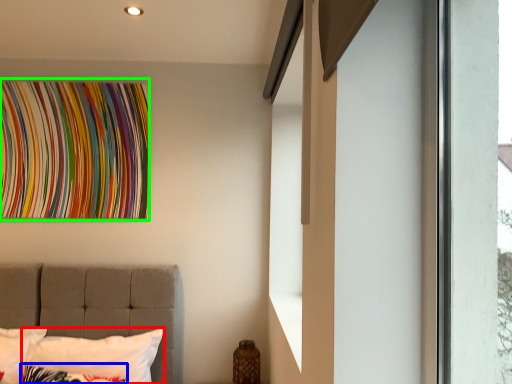
Question: Based on their relative distances, which object is farther from pillow (highlighted by a red box)? Choose from pillow (highlighted by a blue box) and tapestry (highlighted by a green box).

Choices:
 (A) pillow
 (B) tapestry

Answer: (B)